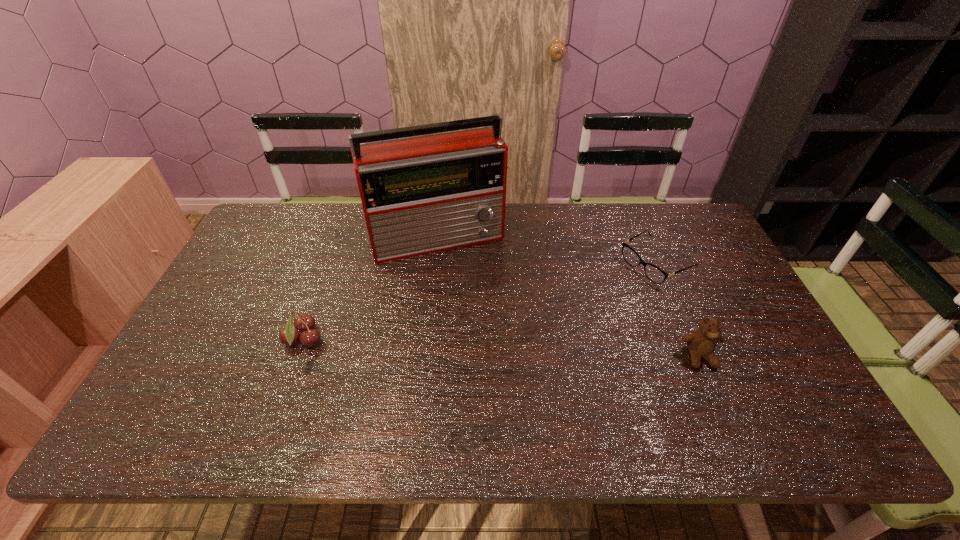
Locate an element on the screen. The height and width of the screenshot is (540, 960). free space on the desktop that is between the second shortest object and the teddy bear and is positioned on the front-facing side of the spectacles is located at coordinates (497, 348).

What are the coordinates of `free spot on the desktop that is between the cherry and the teddy bear and is positioned on the front-facing side of the second object from left to right` in the screenshot? It's located at (480, 348).